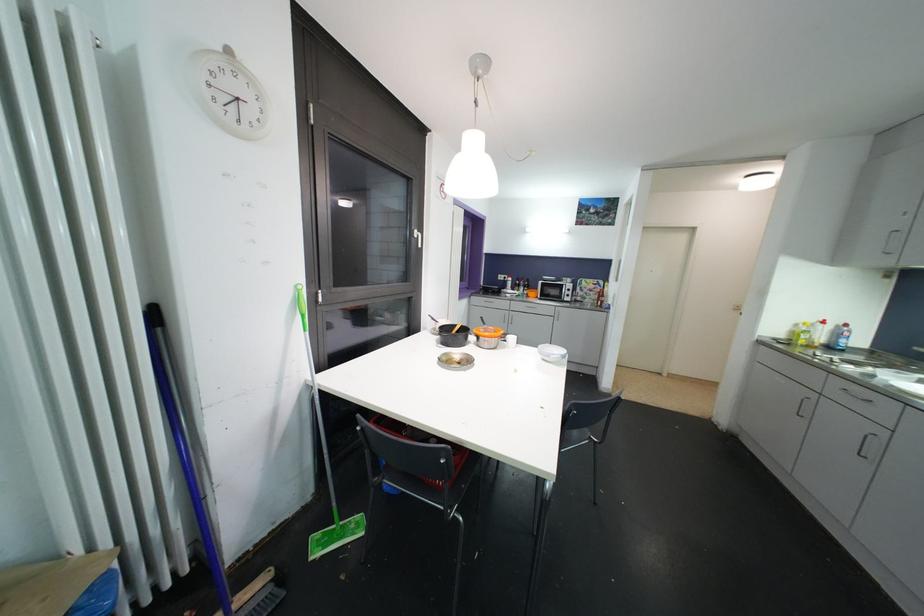
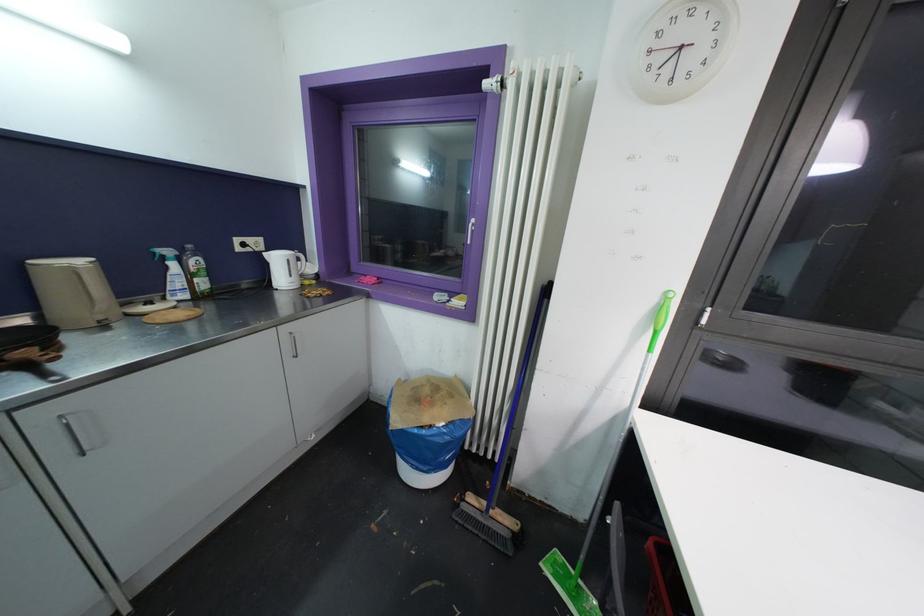
In the second image, find the point that corresponds to point (308, 334) in the first image.

(652, 354)